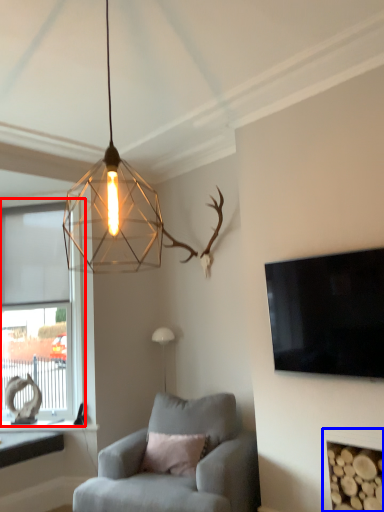
Question: Which point is closer to the camera, window (highlighted by a red box) or fireplace (highlighted by a blue box)?

Choices:
 (A) window
 (B) fireplace

Answer: (B)